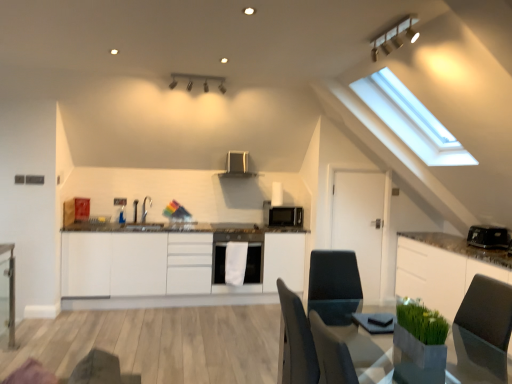
Describe the element at coordinates (247, 255) in the screenshot. I see `white matte dishwasher at center` at that location.

Describe the element at coordinates (488, 237) in the screenshot. Image resolution: width=512 pixels, height=384 pixels. I see `black plastic toaster at right` at that location.

What do you see at coordinates (198, 79) in the screenshot?
I see `matte black light fixture at upper center, arranged as the 1th light fixture when viewed from the left` at bounding box center [198, 79].

Locate an element on the screen. matte black exhaust hood at upper center is located at coordinates (237, 165).

What do you see at coordinates (237, 165) in the screenshot?
I see `matte black exhaust hood at upper center` at bounding box center [237, 165].

I want to click on white matte dishwasher at center, so click(x=247, y=255).

Which of these two, matte black exhaust hood at upper center or black matte microwave at center, is wider?

matte black exhaust hood at upper center is wider.

In the scene shown: Is matte black exhaust hood at upper center spatially inside black matte microwave at center, or outside of it?

matte black exhaust hood at upper center cannot be found inside black matte microwave at center.

Considering their positions, is matte black exhaust hood at upper center located in front of or behind black matte microwave at center?

matte black exhaust hood at upper center is in front of black matte microwave at center.

Is matte black exhaust hood at upper center to the left of white matte door at center from the viewer's perspective?

Correct, you'll find matte black exhaust hood at upper center to the left of white matte door at center.

Which point is more distant from viewer, (219, 176) or (370, 275)?

The point (219, 176) is farther from the camera.

Can you confirm if matte black exhaust hood at upper center is taller than white matte door at center?

In fact, matte black exhaust hood at upper center may be shorter than white matte door at center.

From the picture: Which object is further away from the camera taking this photo, matte black exhaust hood at upper center or white matte door at center?

matte black exhaust hood at upper center is more distant.

Does black matte microwave at center have a greater height compared to white glossy cabinet at right, which is the 1th cabinetry from right to left?

No, black matte microwave at center is not taller than white glossy cabinet at right, which is the 1th cabinetry from right to left.

Considering the sizes of objects black matte microwave at center and white glossy cabinet at right, which is the 1th cabinetry from right to left, in the image provided, who is thinner, black matte microwave at center or white glossy cabinet at right, which is the 1th cabinetry from right to left,?

With smaller width is black matte microwave at center.

Is black matte microwave at center facing away from white glossy cabinet at right, marked as the second cabinetry in a left-to-right arrangement?

No, black matte microwave at center is not facing away from white glossy cabinet at right, marked as the second cabinetry in a left-to-right arrangement.

The width and height of the screenshot is (512, 384). In order to click on cabinetry that is the 2nd object directly below the matte black exhaust hood at upper center (from a real-world perspective) in this screenshot , I will do `click(170, 266)`.

Considering the points (257, 174) and (285, 268), which point is in front, point (257, 174) or point (285, 268)?

The point (285, 268) is in front.

Measure the distance between matte black exhaust hood at upper center and white matte cabinetry at center, acting as the 2th cabinetry starting from the right.

4.44 feet.

Is there a large distance between matte black exhaust hood at upper center and white matte cabinetry at center, acting as the 2th cabinetry starting from the right?

Absolutely, matte black exhaust hood at upper center is distant from white matte cabinetry at center, acting as the 2th cabinetry starting from the right.

Between matte silver light fixture at upper center, the 2th light fixture when ordered from left to right, and smooth gray table at lower right, the second table viewed from the left, which one appears on the left side from the viewer's perspective?

From the viewer's perspective, smooth gray table at lower right, the second table viewed from the left, appears more on the left side.

Is matte silver light fixture at upper center, which ranks as the 1th light fixture in front-to-back order, smaller than smooth gray table at lower right, acting as the 1th table starting from the front?

Correct, matte silver light fixture at upper center, which ranks as the 1th light fixture in front-to-back order, occupies less space than smooth gray table at lower right, acting as the 1th table starting from the front.

How far apart are matte silver light fixture at upper center, the 2th light fixture when ordered from left to right, and smooth gray table at lower right, which is the 1th table from right to left?

matte silver light fixture at upper center, the 2th light fixture when ordered from left to right, is 1.84 meters away from smooth gray table at lower right, which is the 1th table from right to left.

Is matte silver light fixture at upper center, which is the 2th light fixture from back to front, oriented away from smooth gray table at lower right, placed as the 2th table when sorted from back to front?

No, matte silver light fixture at upper center, which is the 2th light fixture from back to front,'s orientation is not away from smooth gray table at lower right, placed as the 2th table when sorted from back to front.

Is white matte door at center to the left of white glossy cabinet at right, marked as the second cabinetry in a left-to-right arrangement, from the viewer's perspective?

Yes, white matte door at center is to the left of white glossy cabinet at right, marked as the second cabinetry in a left-to-right arrangement.

In the scene shown: Does white matte door at center have a smaller size compared to white glossy cabinet at right, marked as the second cabinetry in a left-to-right arrangement?

Yes, white matte door at center is smaller than white glossy cabinet at right, marked as the second cabinetry in a left-to-right arrangement.

Could you tell me if white matte door at center is facing white glossy cabinet at right, which is the 1th cabinetry from right to left?

No, white matte door at center is not facing towards white glossy cabinet at right, which is the 1th cabinetry from right to left.

Consider the image. Could you measure the distance between white matte door at center and white glossy cabinet at right, marked as the second cabinetry in a left-to-right arrangement?

69.48 centimeters.

Who is shorter, white glossy cabinet at right, which is the 1th cabinetry from right to left, or matte black light fixture at upper center, which ranks as the 2th light fixture in front-to-back order?

matte black light fixture at upper center, which ranks as the 2th light fixture in front-to-back order.

Find the location of `the 2nd light fixture counting from the left side of the white glossy cabinet at right, marked as the second cabinetry in a left-to-right arrangement`. the 2nd light fixture counting from the left side of the white glossy cabinet at right, marked as the second cabinetry in a left-to-right arrangement is located at coordinates (198, 79).

Considering the relative sizes of white glossy cabinet at right, which is the 1th cabinetry from right to left, and matte black light fixture at upper center, arranged as the 1th light fixture when viewed from the left, in the image provided, is white glossy cabinet at right, which is the 1th cabinetry from right to left, smaller than matte black light fixture at upper center, arranged as the 1th light fixture when viewed from the left,?

No, white glossy cabinet at right, which is the 1th cabinetry from right to left, is not smaller than matte black light fixture at upper center, arranged as the 1th light fixture when viewed from the left.

Is white glossy cabinet at right, marked as the second cabinetry in a left-to-right arrangement, not near matte black light fixture at upper center, the 1th light fixture in the back-to-front sequence?

Indeed, white glossy cabinet at right, marked as the second cabinetry in a left-to-right arrangement, is not near matte black light fixture at upper center, the 1th light fixture in the back-to-front sequence.

This screenshot has width=512, height=384. In order to click on exhaust hood on the left of black matte microwave at center in this screenshot , I will do `click(237, 165)`.

Image resolution: width=512 pixels, height=384 pixels. I want to click on door in front of the matte black exhaust hood at upper center, so click(362, 224).

Estimate the real-world distances between objects in this image. Which object is further from smooth gray table at lower right, acting as the 1th table starting from the front, white matte cabinetry at center, which is counted as the first cabinetry, starting from the left, or matte black light fixture at upper center, which ranks as the 2th light fixture in front-to-back order?

matte black light fixture at upper center, which ranks as the 2th light fixture in front-to-back order, lies further to smooth gray table at lower right, acting as the 1th table starting from the front, than the other object.

Considering their positions, is smooth gray table at lower right, acting as the 1th table starting from the front, positioned further to matte black light fixture at upper center, the 2th light fixture positioned from the right, than white matte cabinetry at center, acting as the 2th cabinetry starting from the right?

smooth gray table at lower right, acting as the 1th table starting from the front, is further to matte black light fixture at upper center, the 2th light fixture positioned from the right.

Looking at the image, which one is located closer to matte black exhaust hood at upper center, black plastic toaster at right or white matte door at center?

white matte door at center lies closer to matte black exhaust hood at upper center than the other object.

Which object lies nearer to the anchor point white matte door at center, black matte microwave at center or white matte cabinetry at center, acting as the 2th cabinetry starting from the right?

The object closer to white matte door at center is black matte microwave at center.

Considering their positions, is white matte door at center positioned further to matte black light fixture at upper center, the 1th light fixture in the back-to-front sequence, than black plastic toaster at right?

black plastic toaster at right lies further to matte black light fixture at upper center, the 1th light fixture in the back-to-front sequence, than the other object.

Looking at the image, which one is located further to matte silver light fixture at upper center, which ranks as the 1th light fixture in front-to-back order, white matte dishwasher at center or white glossy cabinet at right, which is the 1th cabinetry from right to left?

white matte dishwasher at center is further to matte silver light fixture at upper center, which ranks as the 1th light fixture in front-to-back order.

Estimate the real-world distances between objects in this image. Which object is closer to white matte dishwasher at center, white matte cabinetry at center, which is counted as the first cabinetry, starting from the left, or smooth gray table at lower right, placed as the 2th table when sorted from back to front?

white matte cabinetry at center, which is counted as the first cabinetry, starting from the left, lies closer to white matte dishwasher at center than the other object.

Which object lies nearer to the anchor point matte black exhaust hood at upper center, smooth gray table at lower right, the second table viewed from the left, or black plastic toaster at right?

The object closer to matte black exhaust hood at upper center is black plastic toaster at right.

Identify the location of exhaust hood between matte black light fixture at upper center, which ranks as the 2th light fixture in front-to-back order, and black plastic toaster at right, in the horizontal direction. (237, 165).

Locate an element on the screen. This screenshot has width=512, height=384. dish washer between matte silver light fixture at upper center, which ranks as the 1th light fixture in front-to-back order, and matte black exhaust hood at upper center, along the z-axis is located at coordinates (247, 255).

Where is `exhaust hood between white matte cabinetry at center, acting as the 2th cabinetry starting from the right, and white matte door at center from left to right`? The width and height of the screenshot is (512, 384). exhaust hood between white matte cabinetry at center, acting as the 2th cabinetry starting from the right, and white matte door at center from left to right is located at coordinates (237, 165).

Where is `door between smooth gray table at lower right, the second table viewed from the left, and black matte microwave at center, along the z-axis`? Image resolution: width=512 pixels, height=384 pixels. door between smooth gray table at lower right, the second table viewed from the left, and black matte microwave at center, along the z-axis is located at coordinates (362, 224).